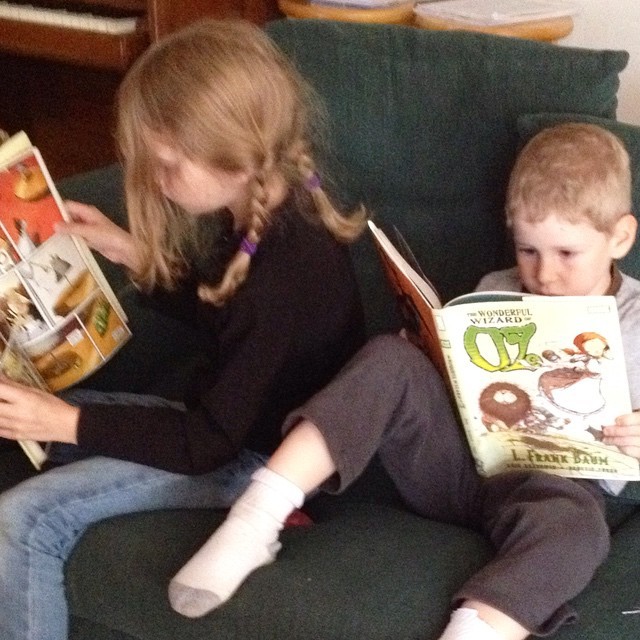
Identify the location of books. The width and height of the screenshot is (640, 640). (516, 402), (38, 283).